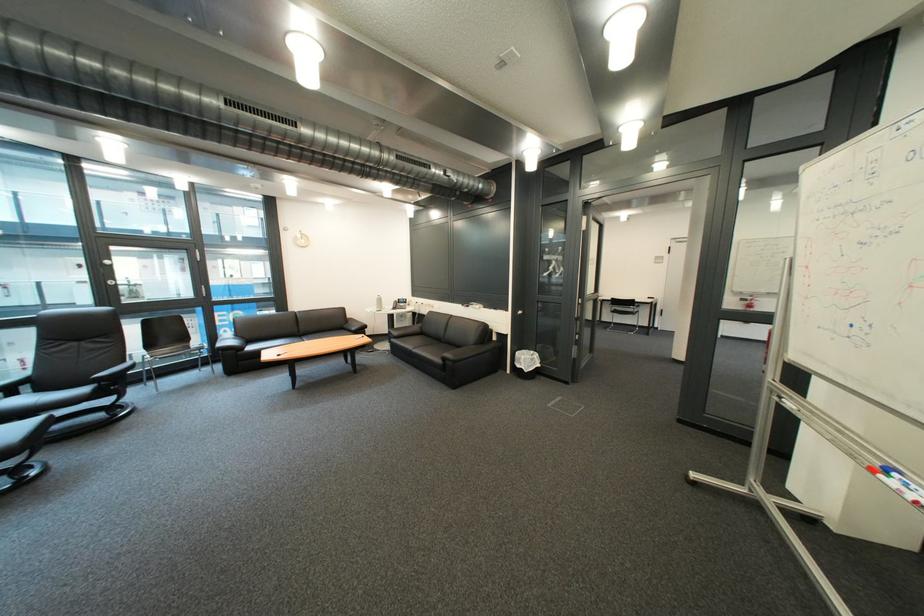
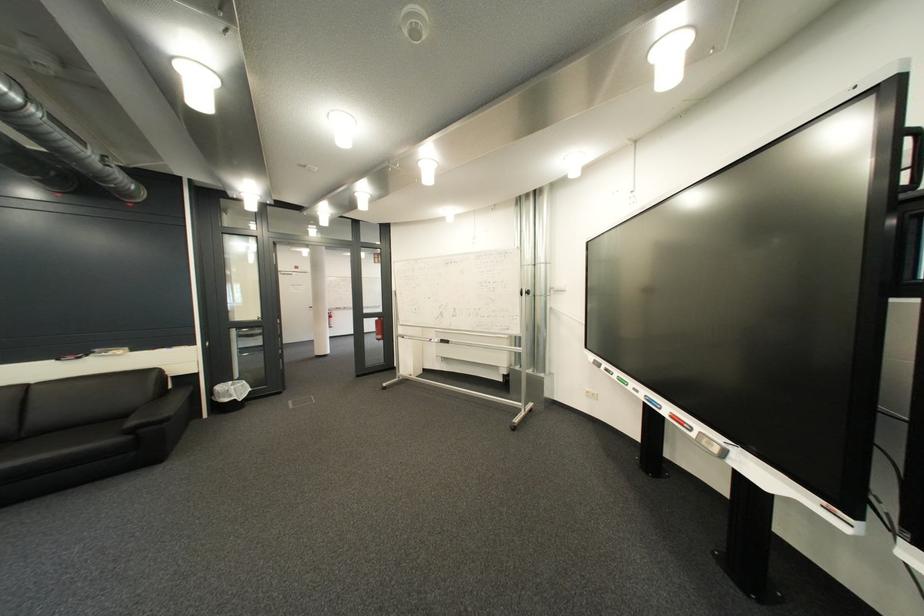
The point at (735, 323) is marked in the first image. Where is the corresponding point in the second image?

(379, 321)